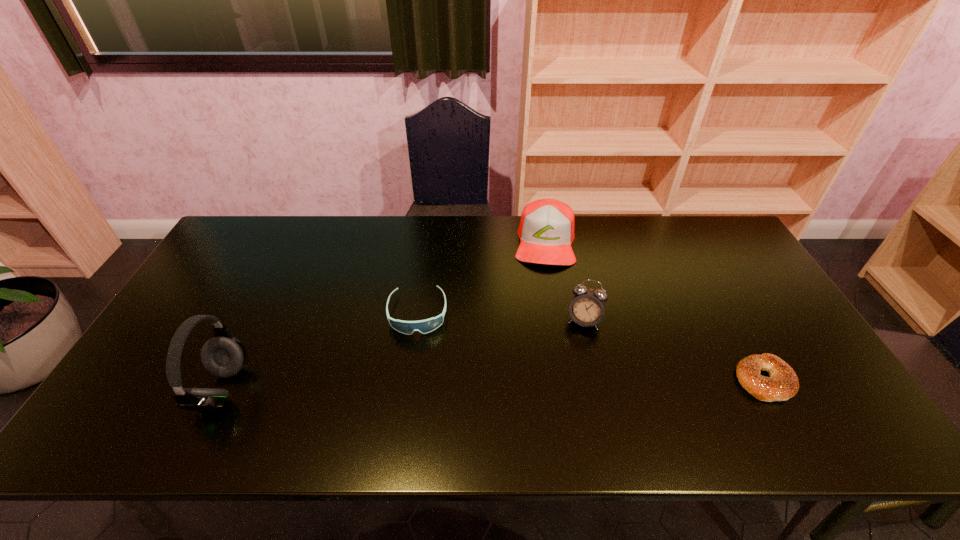
This screenshot has width=960, height=540. I want to click on vacant space on the desktop that is between the leftmost object and the shortest object and is positioned on the front-facing side of the fourth object from right to left, so click(x=416, y=385).

Locate an element on the screen. The image size is (960, 540). free space on the desktop that is between the tallest object and the rightmost object and is positioned on the front-facing side of the farthest object is located at coordinates (x=543, y=383).

Identify the location of vacant space on the desktop that is between the tallest object and the shortest object and is positioned on the face of the alarm clock. This screenshot has width=960, height=540. (570, 383).